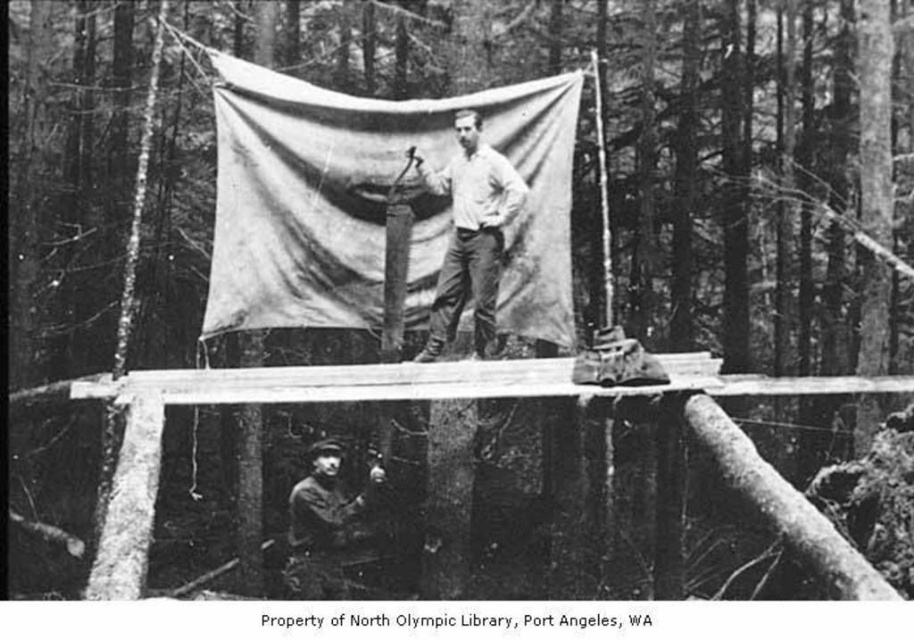
You are a safety inspector assessing the logging site. You notice the matte canvas tarp at center and the smooth wood at lower left. Which object is positioned higher in the scene?

The matte canvas tarp at center is much taller than the smooth wood at lower left, so it is positioned higher in the scene.

You are a photographer analyzing the image. You notice the smooth white shirt at center and the rugged leather jacket at lower center. Which clothing item appears larger in the photo?

The smooth white shirt at center appears larger than the rugged leather jacket at lower center in the photo.